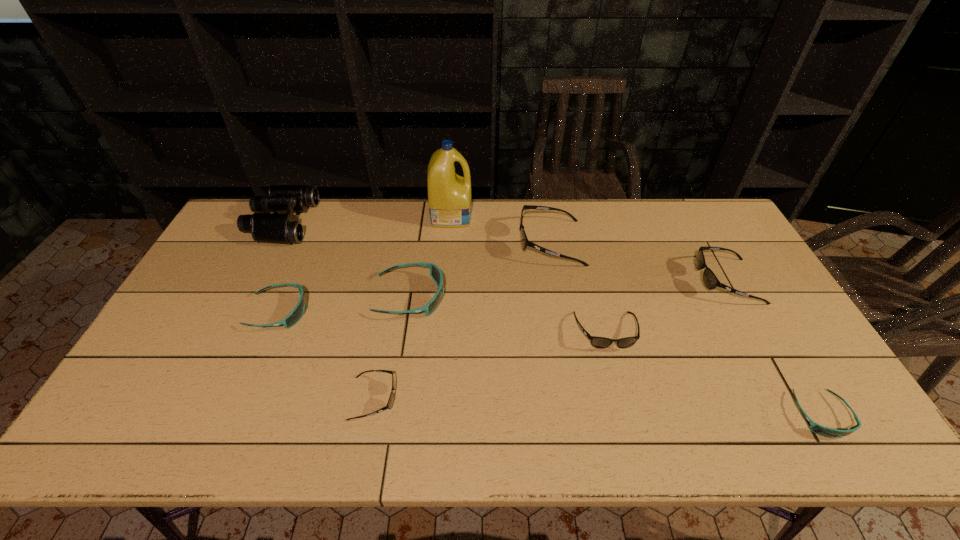
You are a GUI agent. You are given a task and a screenshot of the screen. Output one action in this format:
    pyautogui.click(x=<x>, y=<y>)
    Task: Click on the smallest gray sunglasses
    This screenshot has height=540, width=960.
    Given the screenshot: What is the action you would take?
    pyautogui.click(x=390, y=402)

The width and height of the screenshot is (960, 540). Identify the location of the leftmost gray sunglasses. coord(390,402).

Identify the location of the rightmost cyan sunglasses. (827, 432).

Locate an element on the screen. This screenshot has width=960, height=540. the nearest cyan sunglasses is located at coordinates (827, 432).

You are a GUI agent. You are given a task and a screenshot of the screen. Output one action in this format:
    pyautogui.click(x=<x>, y=<y>)
    Task: Click on the free point located on the label of the detergent
    The height and width of the screenshot is (540, 960).
    Given the screenshot: What is the action you would take?
    click(x=566, y=215)

Locate an element on the screen. The width and height of the screenshot is (960, 540). vacant space situated on the front-facing side of the eighth shortest object is located at coordinates (334, 222).

Identify the location of vacant space located 0.340m on the front-facing side of the third tallest object. (418, 243).

Identify the location of free point located 0.280m on the front-facing side of the third tallest object. (436, 243).

This screenshot has height=540, width=960. In order to click on vacant space situated 0.200m on the front-facing side of the third tallest object in this screenshot , I will do `click(459, 243)`.

Find the location of a particular element. Image resolution: width=960 pixels, height=540 pixels. vacant position located on the front-facing side of the third smallest gray sunglasses is located at coordinates (619, 281).